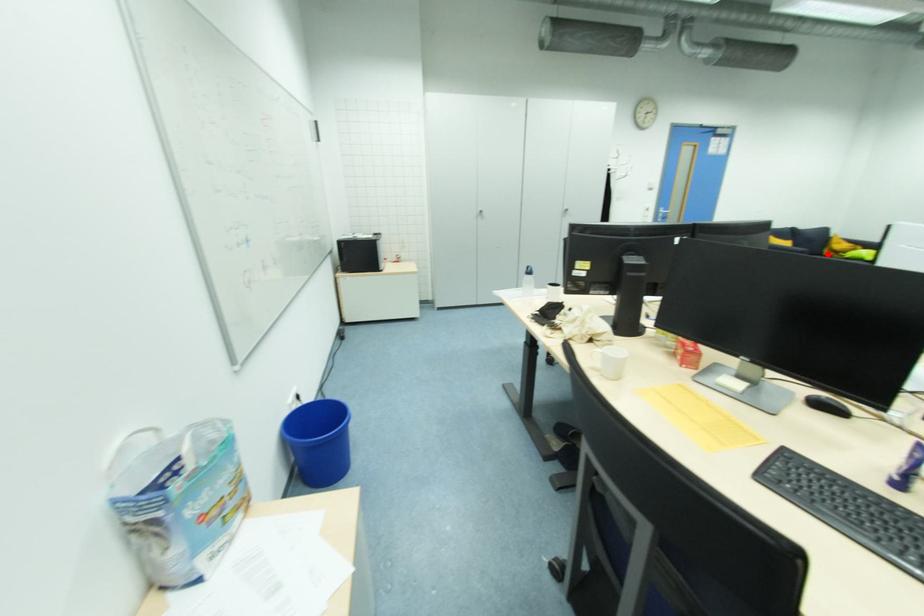
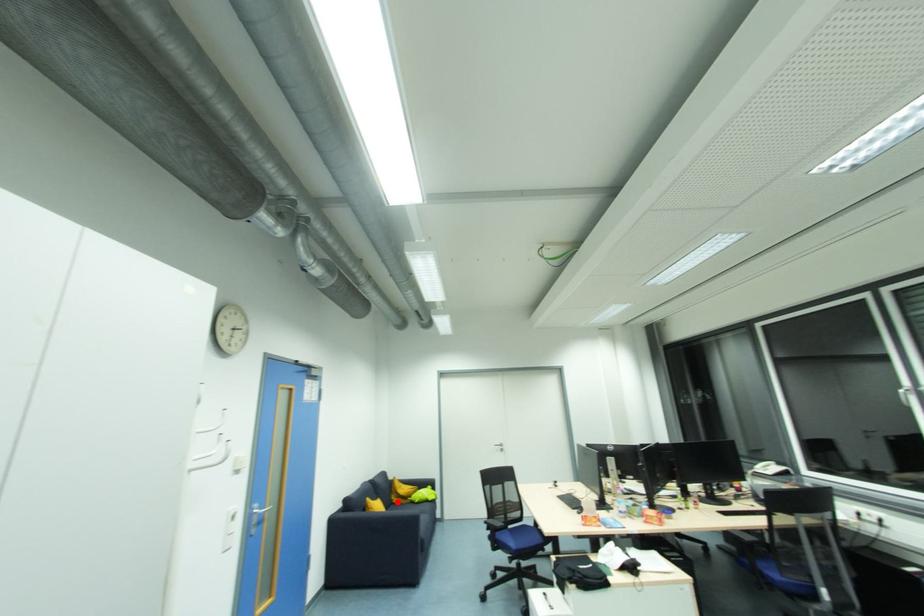
I am providing you with two images of the same scene from different viewpoints. A red point is marked on the first image and another point is marked on the second image. Do the highlighted points in image1 and image2 indicate the same real-world spot?

Yes